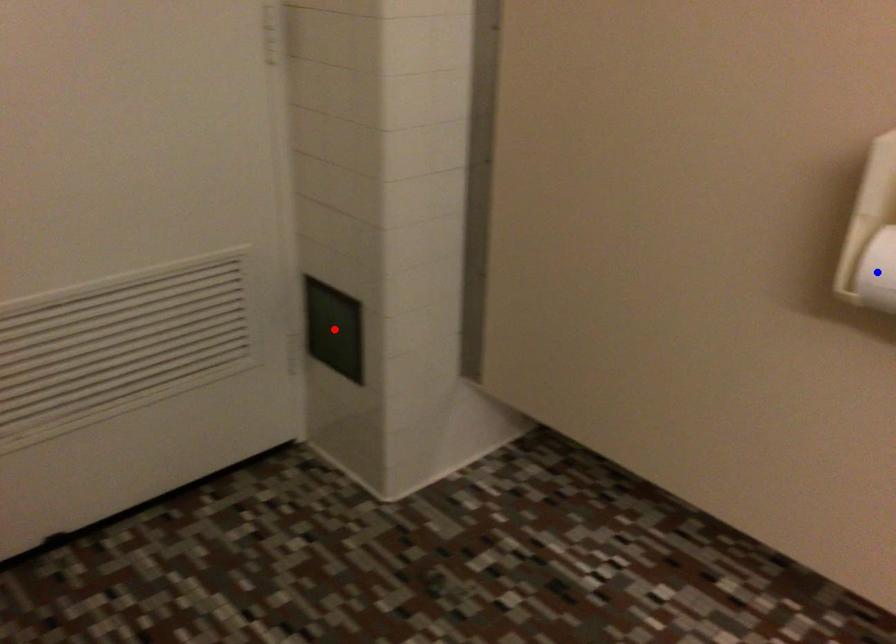
Question: Which of the two points in the image is closer to the camera?

Choices:
 (A) Blue point is closer.
 (B) Red point is closer.

Answer: (A)